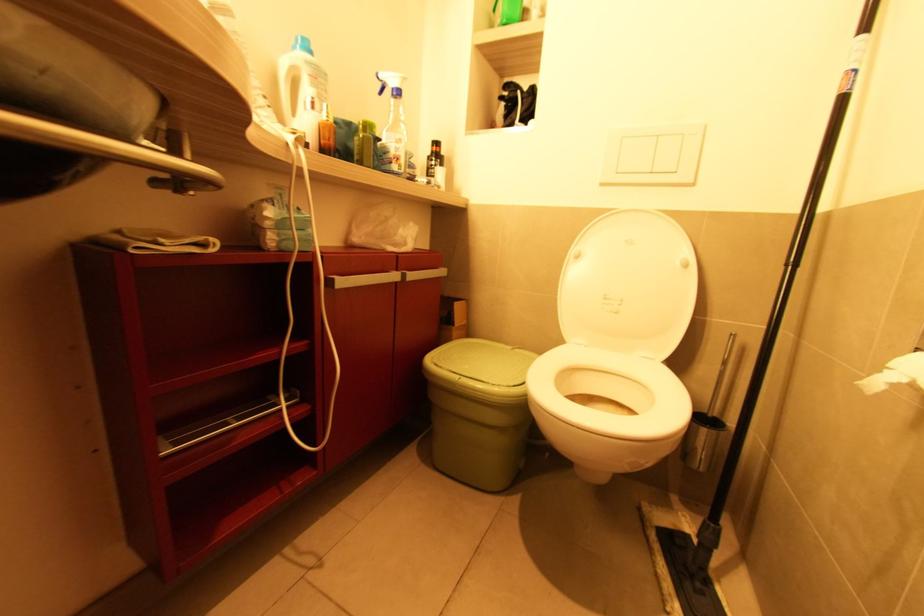
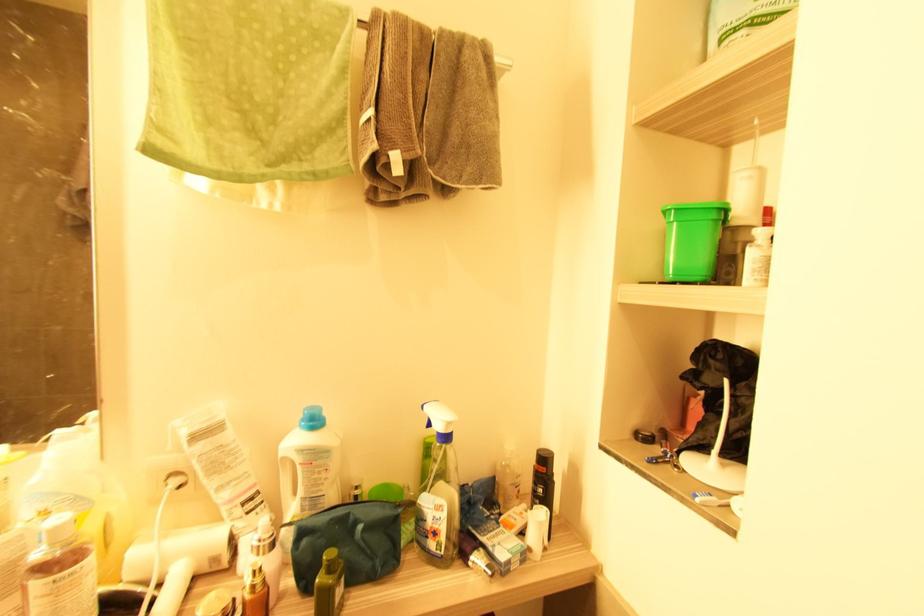
Locate, in the second image, the point that corresponds to pixel 399 94 in the first image.

(447, 438)